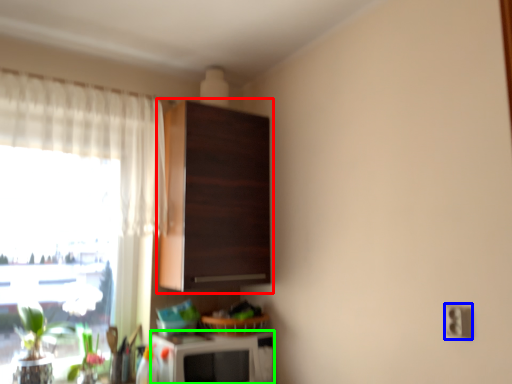
Question: Which object is positioned closest to cabinetry (highlighted by a red box)? Select from electric outlet (highlighted by a blue box) and appliance (highlighted by a green box).

Choices:
 (A) electric outlet
 (B) appliance

Answer: (B)